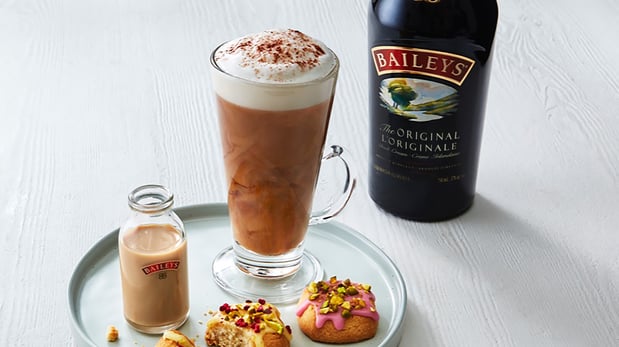
Identify the location of round tray. Image resolution: width=619 pixels, height=347 pixels. (371, 266).